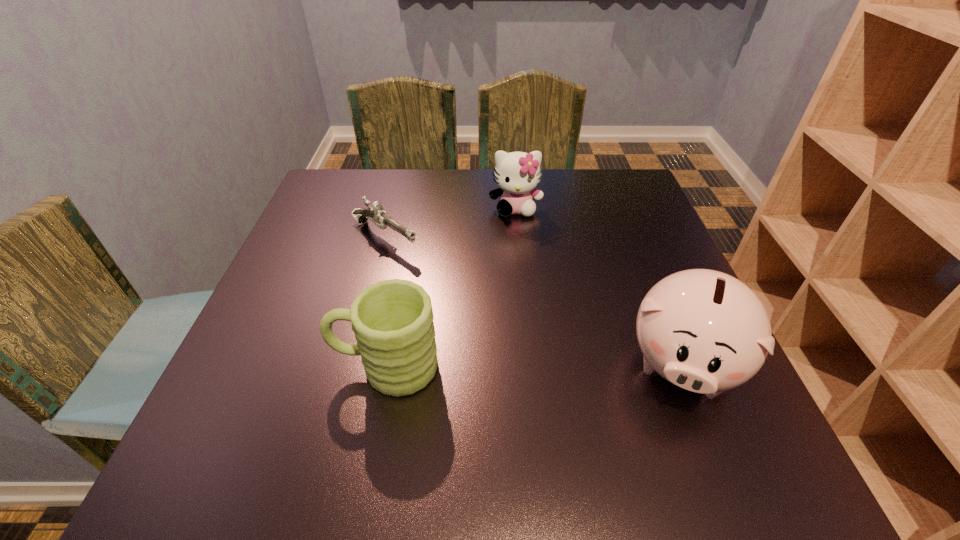
Image resolution: width=960 pixels, height=540 pixels. In order to click on free space located aimed along the barrel of the gun in this screenshot , I will do `click(501, 315)`.

The width and height of the screenshot is (960, 540). I want to click on vacant area situated aimed along the barrel of the gun, so click(x=537, y=339).

Image resolution: width=960 pixels, height=540 pixels. In order to click on vacant space situated aimed along the barrel of the gun in this screenshot , I will do `click(529, 334)`.

Locate an element on the screen. The height and width of the screenshot is (540, 960). object situated at the far edge is located at coordinates (517, 174).

Locate an element on the screen. mug located in the near edge section of the desktop is located at coordinates (392, 320).

Locate an element on the screen. This screenshot has height=540, width=960. piggy bank that is positioned at the near edge is located at coordinates (705, 331).

You are a GUI agent. You are given a task and a screenshot of the screen. Output one action in this format:
    pyautogui.click(x=<x>, y=<y>)
    Task: Click on the object that is at the left edge
    
    Given the screenshot: What is the action you would take?
    pyautogui.click(x=375, y=213)

The height and width of the screenshot is (540, 960). What are the coordinates of `object present at the right edge` in the screenshot? It's located at (705, 331).

You are a GUI agent. You are given a task and a screenshot of the screen. Output one action in this format:
    pyautogui.click(x=<x>, y=<y>)
    Task: Click on the object situated at the near right corner
    
    Given the screenshot: What is the action you would take?
    pyautogui.click(x=705, y=331)

Identify the location of blank area at the far edge. (482, 200).